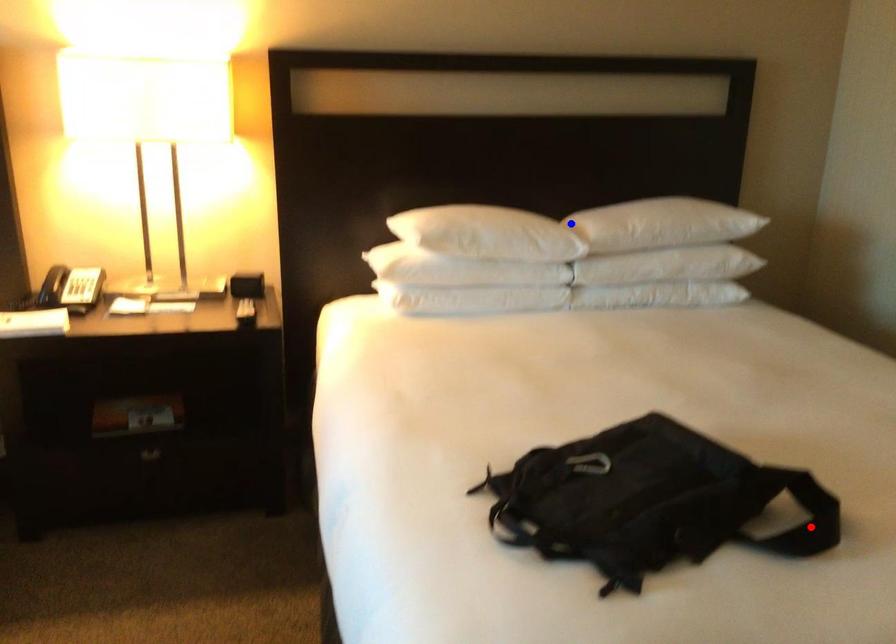
Question: Which of the two points in the image is closer to the camera?

Choices:
 (A) Blue point is closer.
 (B) Red point is closer.

Answer: (B)